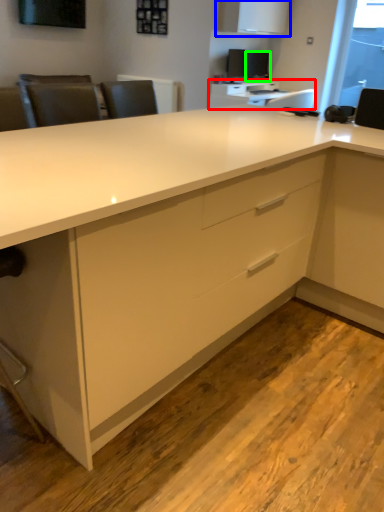
Question: Considering the real-world distances, which object is farthest from table (highlighted by a red box)? cabinetry (highlighted by a blue box) or computer monitor (highlighted by a green box)?

Choices:
 (A) cabinetry
 (B) computer monitor

Answer: (B)